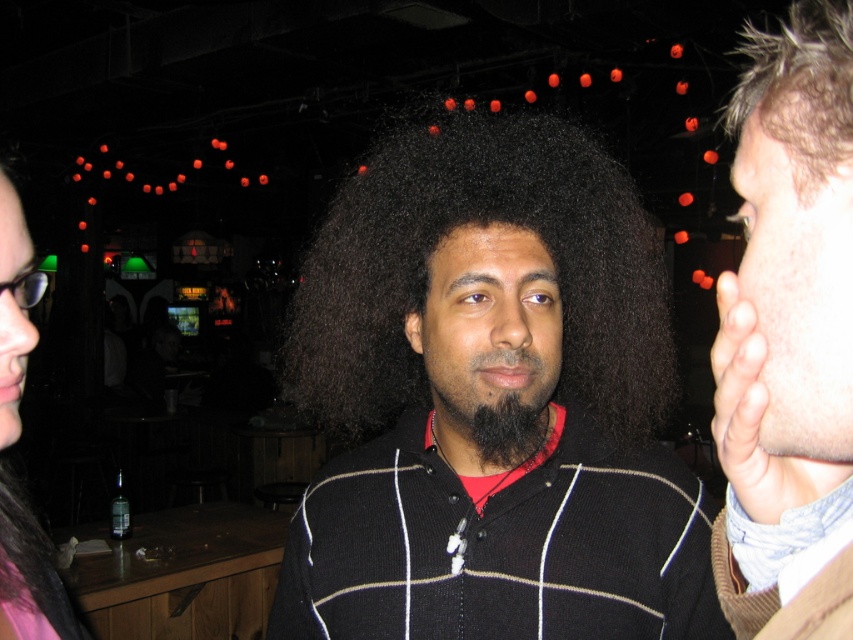
Question: Does black matte sweater at center have a smaller size compared to smooth skin face at right?

Choices:
 (A) yes
 (B) no

Answer: (B)

Question: Based on their relative distances, which object is farther from the smooth skin face at right?

Choices:
 (A) matte black hair at left
 (B) black matte beard at center
 (C) black matte sweater at center

Answer: (A)

Question: Which is nearer to the smooth skin face at right?

Choices:
 (A) black matte sweater at center
 (B) matte black hair at left

Answer: (A)

Question: Is black matte beard at center bigger than matte black hair at left?

Choices:
 (A) yes
 (B) no

Answer: (B)

Question: Can you confirm if black matte sweater at center is positioned to the left of matte black hair at left?

Choices:
 (A) no
 (B) yes

Answer: (A)

Question: Among these points, which one is farthest from the camera?

Choices:
 (A) (532, 364)
 (B) (74, 618)

Answer: (B)